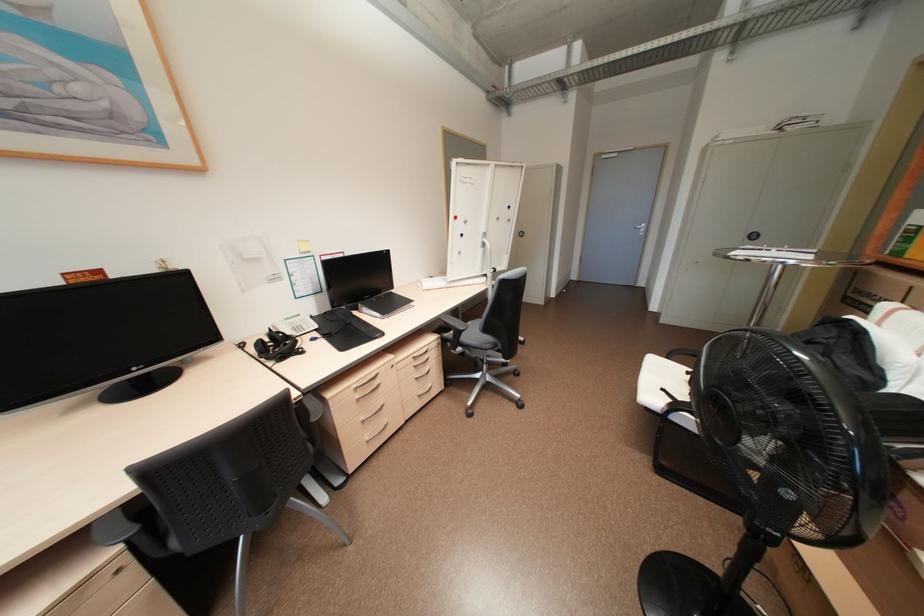
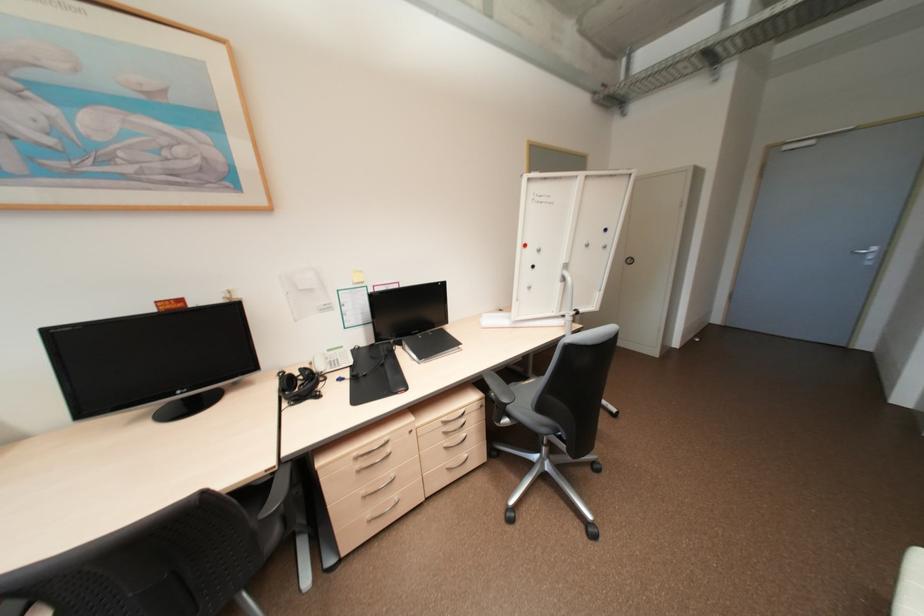
Locate, in the second image, the point that corresponds to [265,342] in the first image.

(297, 377)